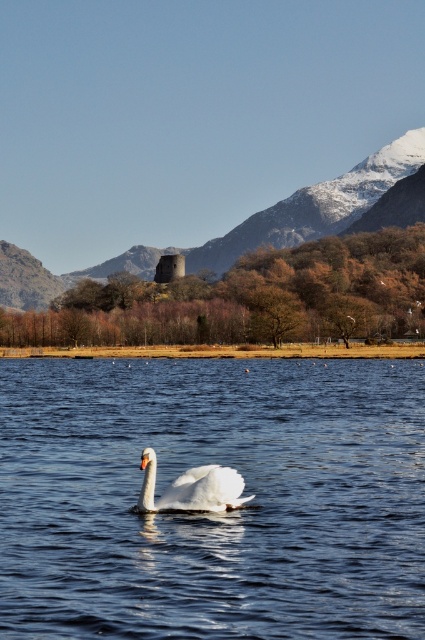
Between smooth stone tower at center and white glossy swan at center, which one has less height?

white glossy swan at center

Describe the element at coordinates (232, 228) in the screenshot. I see `smooth stone tower at center` at that location.

Find the location of a particular element. This screenshot has height=640, width=425. smooth stone tower at center is located at coordinates (232, 228).

Can you confirm if clear blue water at center is thinner than white glossy swan at center?

No.

Is clear blue water at center to the left of white glossy swan at center from the viewer's perspective?

Indeed, clear blue water at center is positioned on the left side of white glossy swan at center.

Where is `clear blue water at center`? The image size is (425, 640). clear blue water at center is located at coordinates (212, 513).

You are a GUI agent. You are given a task and a screenshot of the screen. Output one action in this format:
    pyautogui.click(x=<x>, y=<y>)
    Task: Click on the clear blue water at center
    The width and height of the screenshot is (425, 640).
    Given the screenshot: What is the action you would take?
    coord(212,513)

Which is above, clear blue water at center or smooth stone tower at center?

smooth stone tower at center is higher up.

Does clear blue water at center have a greater width compared to smooth stone tower at center?

No, clear blue water at center is not wider than smooth stone tower at center.

Image resolution: width=425 pixels, height=640 pixels. What are the coordinates of `clear blue water at center` in the screenshot? It's located at (212, 513).